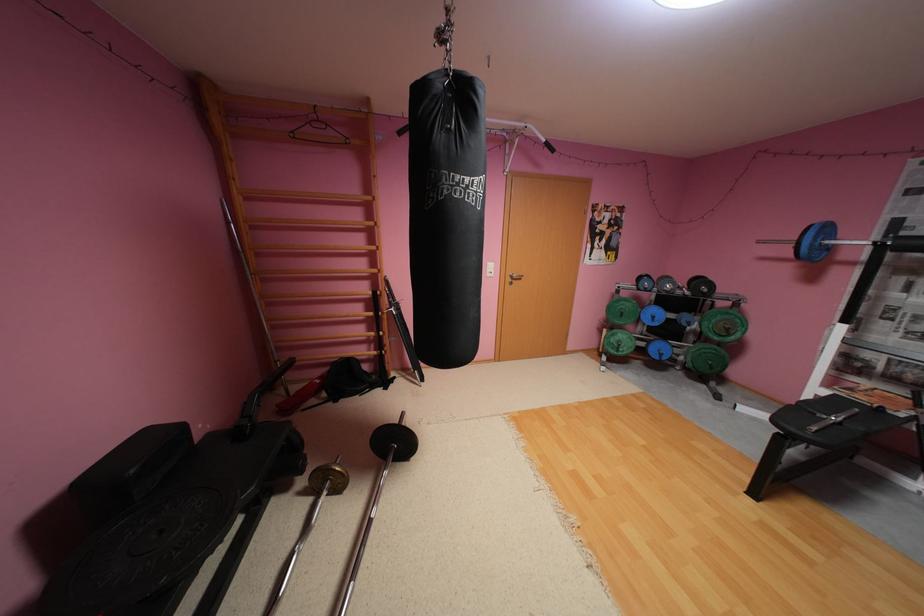
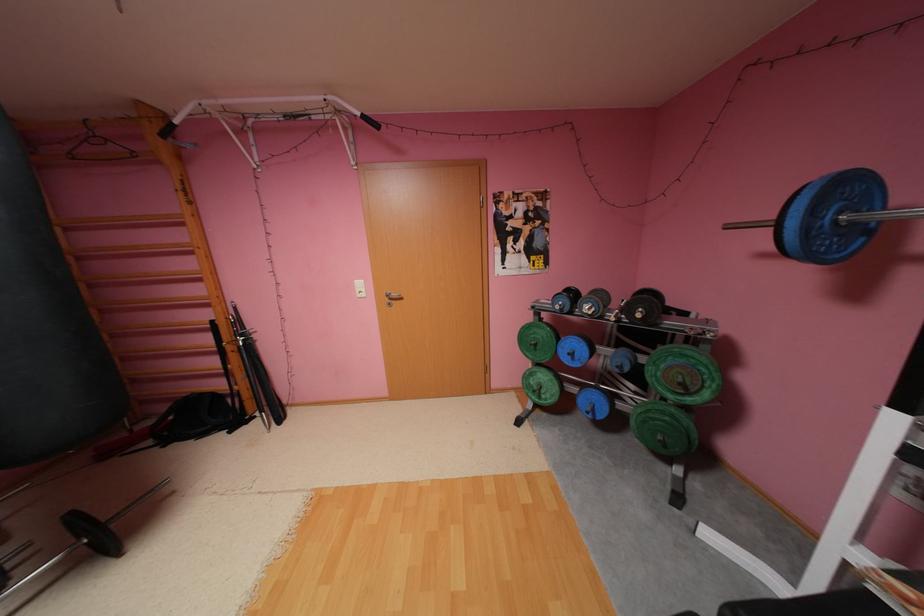
The point at (x=714, y=291) is marked in the first image. Where is the corresponding point in the second image?

(648, 315)